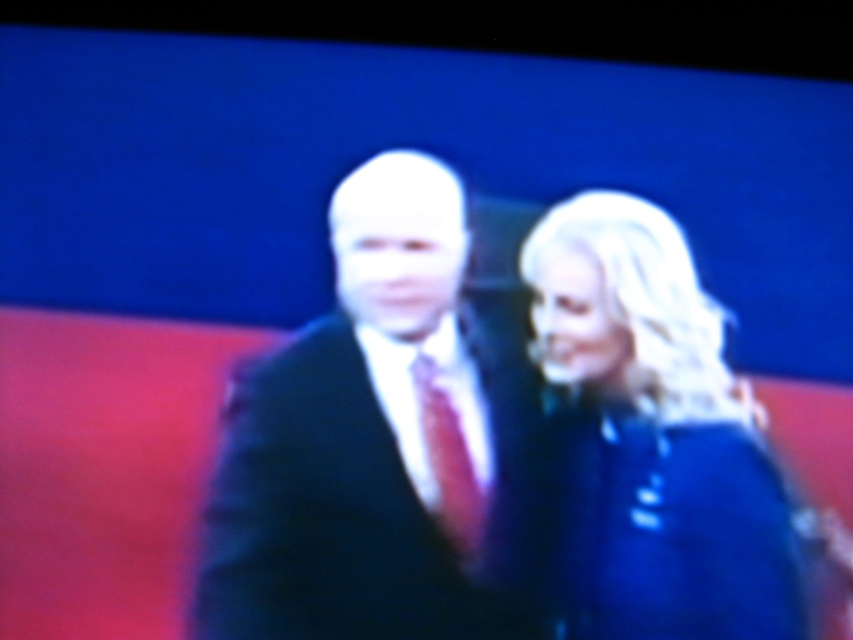
Can you confirm if shiny blue coat at right is smaller than shiny red tie at center?

Incorrect, shiny blue coat at right is not smaller in size than shiny red tie at center.

Which is in front, point (746, 557) or point (469, 512)?

Point (746, 557) is in front.

In order to click on shiny blue coat at right in this screenshot , I will do `click(657, 435)`.

Looking at this image, does matte black suit at center have a lesser height compared to shiny red tie at center?

No.

Who is more forward, (476, 522) or (444, 529)?

Point (444, 529) is in front.

Describe the element at coordinates (370, 444) in the screenshot. I see `matte black suit at center` at that location.

You are a GUI agent. You are given a task and a screenshot of the screen. Output one action in this format:
    pyautogui.click(x=<x>, y=<y>)
    Task: Click on the matte black suit at center
    
    Given the screenshot: What is the action you would take?
    (x=370, y=444)

Does matte black suit at center have a greater height compared to shiny blue coat at right?

Yes, matte black suit at center is taller than shiny blue coat at right.

Between matte black suit at center and shiny blue coat at right, which one has more height?

Standing taller between the two is matte black suit at center.

Which is in front, point (508, 572) or point (619, 534)?

Point (619, 534) is more forward.

Identify the location of matte black suit at center. The height and width of the screenshot is (640, 853). (370, 444).